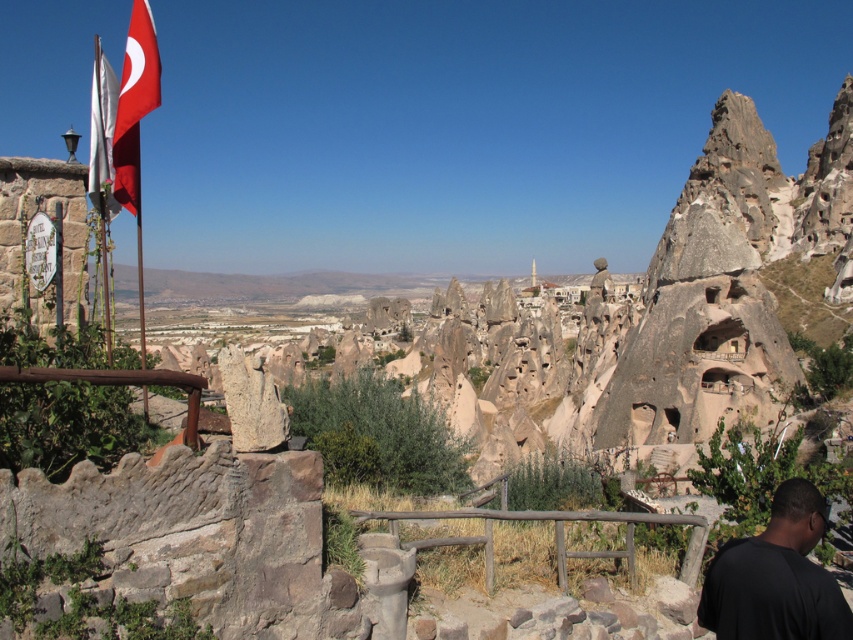
Question: Observing the image, what is the correct spatial positioning of red fabric flag at upper left in reference to white fabric flag at left?

Choices:
 (A) above
 (B) below

Answer: (B)

Question: Can you confirm if black matte shirt at lower right is positioned to the left of white fabric flag at left?

Choices:
 (A) yes
 (B) no

Answer: (B)

Question: Which object is positioned closest to the red fabric flag at upper left?

Choices:
 (A) brown wooden rail at center
 (B) white fabric flag at left
 (C) black matte shirt at lower right

Answer: (A)

Question: Which object is the farthest from the brown wooden rail at center?

Choices:
 (A) red fabric flag at upper left
 (B) white fabric flag at left
 (C) black matte shirt at lower right

Answer: (B)

Question: Which of the following is the closest to the observer?

Choices:
 (A) (625, 540)
 (B) (735, 572)

Answer: (B)

Question: From the image, what is the correct spatial relationship of brown wooden rail at center in relation to red fabric flag at upper left?

Choices:
 (A) below
 (B) above

Answer: (A)